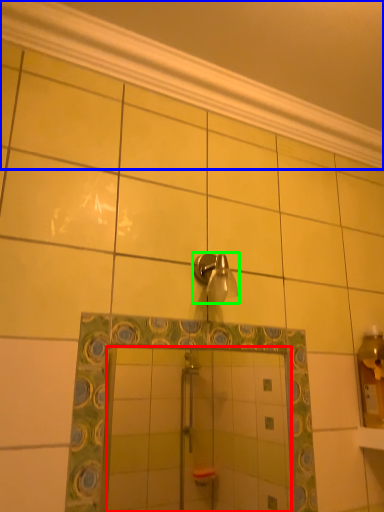
Question: Which is farther away from mirror (highlighted by a red box)? molding (highlighted by a blue box) or shower (highlighted by a green box)?

Choices:
 (A) molding
 (B) shower

Answer: (A)